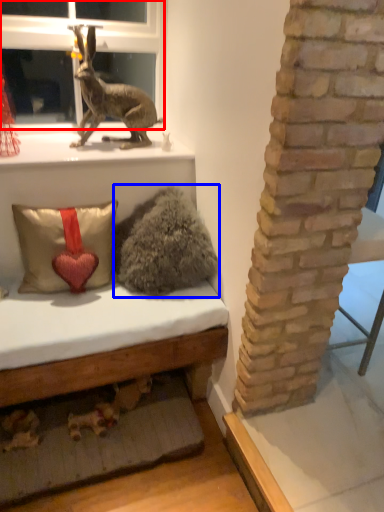
Question: Which object appears farthest to the camera in this image, bay window (highlighted by a red box) or animal (highlighted by a blue box)?

Choices:
 (A) bay window
 (B) animal

Answer: (A)